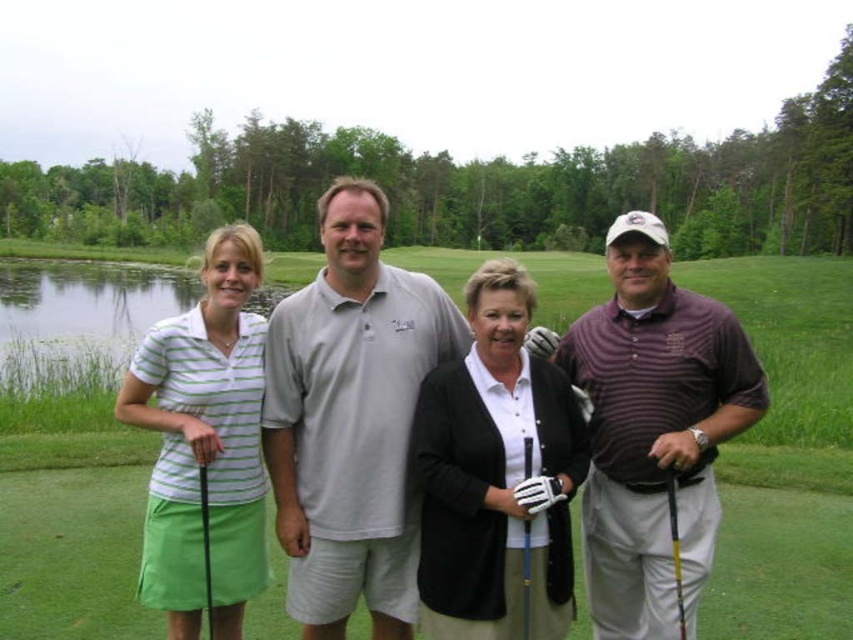
You are a photographer trying to capture a clear shot of the striped cotton polo shirt at center and the metallic silver golf club at center. Since the sky is overcast, you decide to use a reflector to bounce light onto the subjects. If the reflector is placed behind you, which object will receive more light and why?

The striped cotton polo shirt at center will receive more light because it is taller than the metallic silver golf club at center, so the reflector placed behind the photographer will illuminate the taller object more effectively.

You are a golfer standing on the green grass at center. You want to hit a ball to the hole located at the edge of the green. The hole is 5 meters away from your current position. Can you reach the hole in one shot if your maximum driving distance is 4.5 meters?

The hole is 5 meters away from your current position on the green grass at center, which exceeds your maximum driving distance of 4.5 meters. Therefore, you cannot reach the hole in one shot.

You are a photographer standing at the camera position. You want to take a photo focusing on the two points marked in the image. Which point, point [730,572] or point [526,637], is closer to you?

Point [730,572] is further to the camera than point [526,637], so the point closer to you is point [526,637].